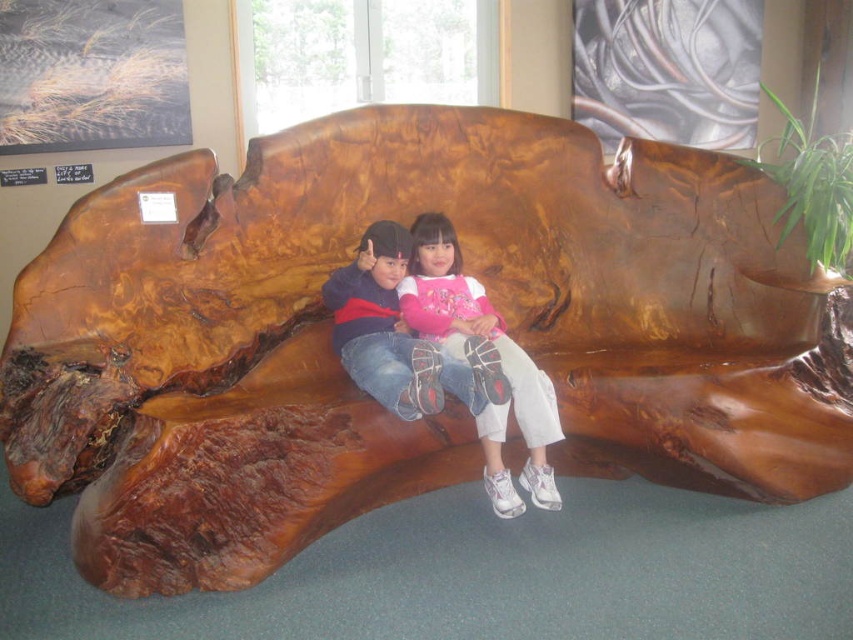
Question: Which point is farther from the camera taking this photo?

Choices:
 (A) (415, 241)
 (B) (346, 333)

Answer: (A)

Question: Does matte pink shirt at center lie behind matte brown wooden bench at center?

Choices:
 (A) yes
 (B) no

Answer: (A)

Question: Is matte pink shirt at center to the left of matte brown wooden bench at center from the viewer's perspective?

Choices:
 (A) no
 (B) yes

Answer: (A)

Question: Which of the following is the farthest from the observer?

Choices:
 (A) matte pink shirt at center
 (B) matte brown wooden bench at center

Answer: (A)

Question: Is matte pink shirt at center thinner than matte brown wooden bench at center?

Choices:
 (A) yes
 (B) no

Answer: (A)

Question: Which of the following is the farthest from the observer?

Choices:
 (A) matte pink shirt at center
 (B) matte brown wooden bench at center

Answer: (A)